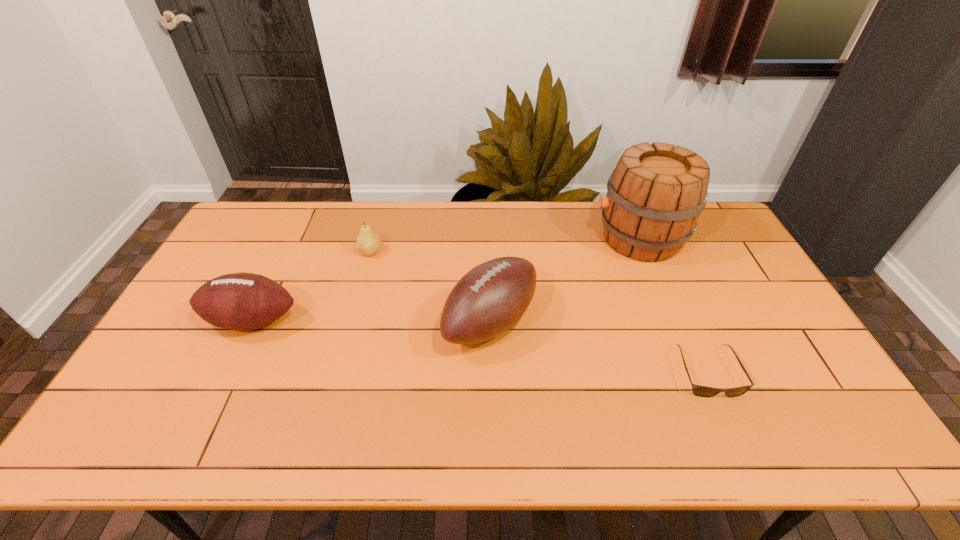
Identify the location of vacant space at the near edge of the desktop. (596, 451).

In the image, there is a desktop. Where is `vacant space at the left edge`? vacant space at the left edge is located at coordinates (204, 337).

What are the coordinates of `free space at the right edge of the desktop` in the screenshot? It's located at (765, 289).

Identify the location of vacant space at the far left corner of the desktop. This screenshot has height=540, width=960. (270, 201).

Identify the location of vacant point located between the taller football (American) and the shorter football (American). Image resolution: width=960 pixels, height=540 pixels. (372, 321).

Identify the location of vacant point located between the shorter football (American) and the second shortest object. This screenshot has width=960, height=540. (311, 286).

Find the location of a particular element. The width and height of the screenshot is (960, 540). blank region between the second shortest object and the sunglasses is located at coordinates (539, 312).

This screenshot has width=960, height=540. Find the location of `vacant area between the second object from left to right and the right football (American)`. vacant area between the second object from left to right and the right football (American) is located at coordinates (430, 287).

The image size is (960, 540). Identify the location of free space between the third tallest object and the sunglasses. (480, 346).

What are the coordinates of `empty space that is in between the tallest object and the taller football (American)` in the screenshot? It's located at (564, 280).